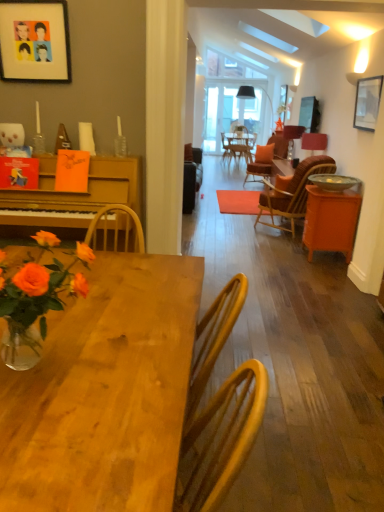
Question: Is matte black lampshade at upper center, which is the second lamp in front-to-back order, taller or shorter than wooden table at center?

Choices:
 (A) tall
 (B) short

Answer: (B)

Question: In terms of width, does matte black lampshade at upper center, arranged as the 1th lamp when viewed from the back, look wider or thinner when compared to wooden table at center?

Choices:
 (A) thin
 (B) wide

Answer: (A)

Question: Estimate the real-world distances between objects in this image. Which object is farther from the metallic silver bowl at right?

Choices:
 (A) green leafy plant at upper left
 (B) wooden table at center
 (C) matte black lampshade at upper center, which is the second lamp in front-to-back order
 (D) metallic silver picture frame at upper right
 (E) wooden woven chair at right

Answer: (B)

Question: Which is nearer to the translucent glass vase at lower left?

Choices:
 (A) metallic silver picture frame at upper right
 (B) wooden table at center
 (C) wooden woven chair at right
 (D) green leafy plant at upper left
 (E) matte red lampshade at right, which is the 2th lamp from back to front

Answer: (B)